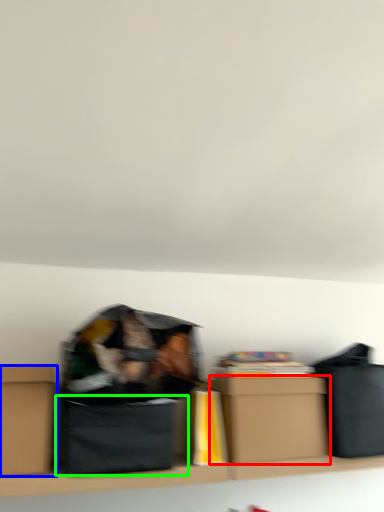
Question: Estimate the real-world distances between objects in this image. Which object is farther from box (highlighted by a red box), box (highlighted by a blue box) or cardboard box (highlighted by a green box)?

Choices:
 (A) box
 (B) cardboard box

Answer: (A)